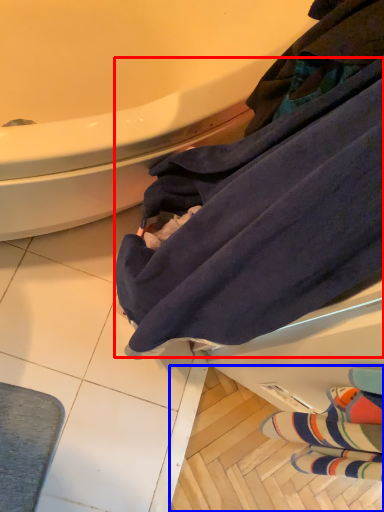
Question: Which of the following is the farthest to the observer, bath towel (highlighted by a red box) or tile (highlighted by a blue box)?

Choices:
 (A) bath towel
 (B) tile

Answer: (B)